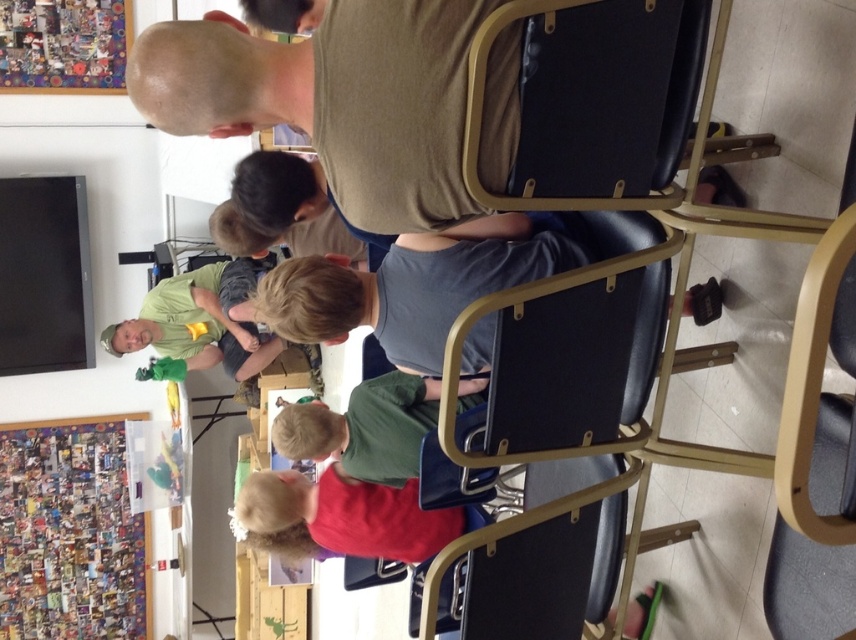
Question: Is light brown plastic chair at lower right bigger than green matte shirt at center?

Choices:
 (A) yes
 (B) no

Answer: (A)

Question: Is the position of light brown plastic chair at lower right less distant than that of red matte shirt at lower center?

Choices:
 (A) yes
 (B) no

Answer: (A)

Question: Can you confirm if light brown plastic chair at lower right is positioned to the left of red matte shirt at lower center?

Choices:
 (A) no
 (B) yes

Answer: (A)

Question: Estimate the real-world distances between objects in this image. Which object is closer to the green fabric shirt at center?

Choices:
 (A) light brown plastic chair at lower right
 (B) brown matte shirt at upper center

Answer: (B)

Question: Estimate the real-world distances between objects in this image. Which object is closer to the green fabric shirt at center?

Choices:
 (A) brown matte shirt at upper center
 (B) light brown plastic chair at lower right

Answer: (A)

Question: Which point is farther to the camera?

Choices:
 (A) green matte shirt at center
 (B) red matte shirt at lower center
 (C) green fabric shirt at center

Answer: (C)